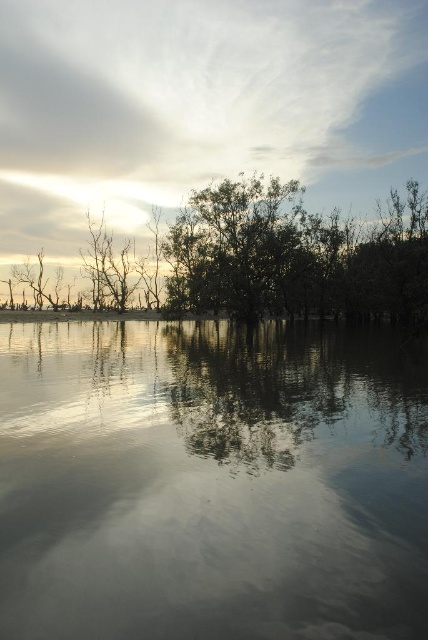
Looking at this image, you are an artist trying to paint the scene. You notice the white fluffy cloud at upper center and the silvery metallic trees at upper center. Which object should you paint first if you want to follow the correct layering order?

You should paint the silvery metallic trees at upper center first because they are behind the white fluffy cloud at upper center, so they need to be layered underneath.

You are standing in the serene landscape described and want to take a photo of the smooth reflective water at center and the white fluffy cloud at upper center. Can you frame both in the same shot without moving your camera position?

Yes, because the smooth reflective water at center is positioned under the white fluffy cloud at upper center, so they are aligned vertically and can be captured in the same frame.